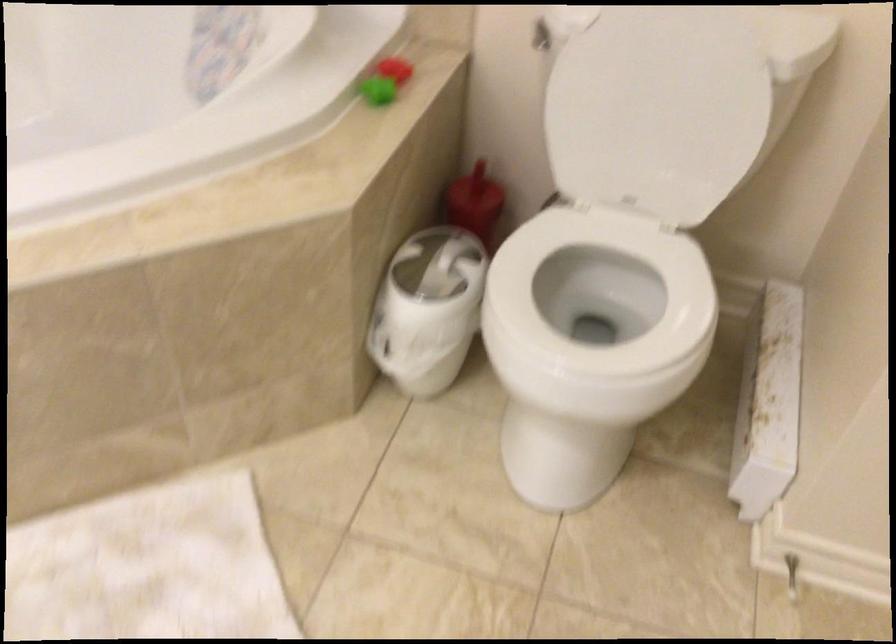
The width and height of the screenshot is (896, 644). What do you see at coordinates (657, 109) in the screenshot? I see `the white toilet lid` at bounding box center [657, 109].